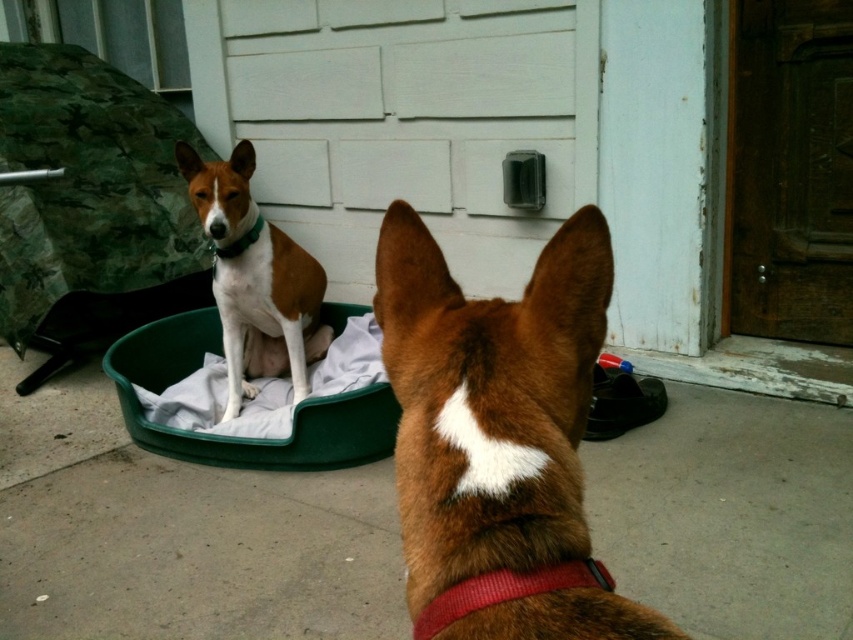
Does green fabric dog bed at center appear on the left side of red fabric neckband at center?

Correct, you'll find green fabric dog bed at center to the left of red fabric neckband at center.

Can you confirm if green fabric dog bed at center is shorter than red fabric neckband at center?

No.

This screenshot has width=853, height=640. In order to click on green fabric dog bed at center in this screenshot , I will do (234, 438).

Which of these two, brown furry dog at center or red fabric neckband at center, stands shorter?

red fabric neckband at center

Is brown furry dog at center thinner than red fabric neckband at center?

No, brown furry dog at center is not thinner than red fabric neckband at center.

Is point (519, 435) behind point (521, 588)?

Yes, it is.

I want to click on brown furry dog at center, so click(x=498, y=440).

The image size is (853, 640). Describe the element at coordinates (498, 440) in the screenshot. I see `brown furry dog at center` at that location.

Image resolution: width=853 pixels, height=640 pixels. What are the coordinates of `brown furry dog at center` in the screenshot? It's located at (498, 440).